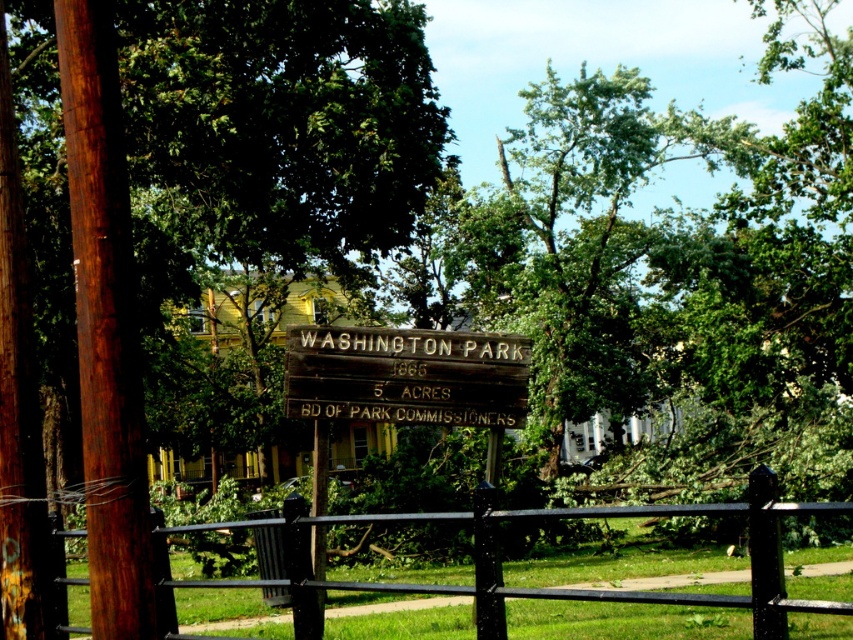
You are a park visitor who wants to take a photo of both the wooden sign at center and the black metal fence at center in the same frame. Given that your camera can capture a maximum distance of 5 meters between objects, will you be able to include both in one shot?

The wooden sign at center and black metal fence at center are 5.39 meters apart from each other. Since the camera can only capture up to 5 meters between objects, the distance is too great to include both in one shot.

You are a landscape architect designing a new pathway in Washington Park. The pathway must be wide enough to accommodate a 3.5 meter wide truck. Given the space between the green leafy tree at center and the black metal fence at center, can the truck pass through this area?

The green leafy tree at center is wider than the black metal fence at center. However, the description does not provide specific measurements of their widths or the distance between them. Without knowing the exact dimensions, it is impossible to determine if the truck can pass through this area.